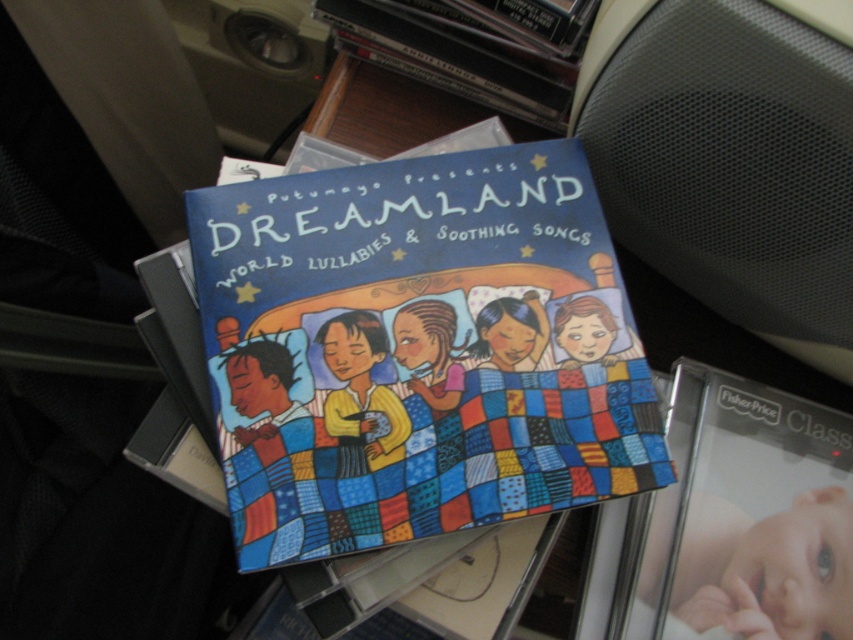
Is point (753, 538) positioned before point (445, 44)?

That is True.

Can you confirm if smooth skin baby at lower right is wider than matte black book at upper center?

No.

Is point (746, 531) more distant than point (329, 4)?

No, it is not.

The width and height of the screenshot is (853, 640). Find the location of `smooth skin baby at lower right`. smooth skin baby at lower right is located at coordinates (767, 568).

Which is behind, point (404, 168) or point (819, 604)?

Positioned behind is point (819, 604).

Find the location of a particular element. Image resolution: width=853 pixels, height=640 pixels. matte blue quilted book at center is located at coordinates (415, 349).

Does point (427, 448) come behind point (792, 616)?

No, (427, 448) is closer to viewer.

Identify the location of matte blue quilted book at center. Image resolution: width=853 pixels, height=640 pixels. (415, 349).

Is matte blue quilted book at center thinner than matte black book at upper center?

No, matte blue quilted book at center is not thinner than matte black book at upper center.

Which is in front, point (567, 291) or point (424, 13)?

Point (567, 291) is more forward.

Locate an element on the screen. The image size is (853, 640). matte blue quilted book at center is located at coordinates (415, 349).